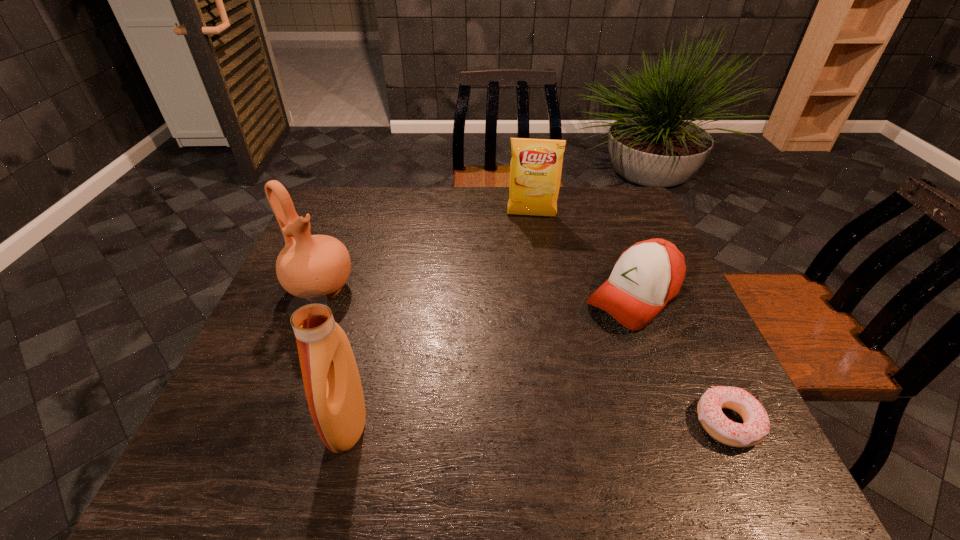
I want to click on free spot between the detergent and the doughnut, so click(x=538, y=423).

The width and height of the screenshot is (960, 540). I want to click on vacant space in between the baseball cap and the detergent, so click(x=491, y=360).

Where is `vacant region between the doughnut and the detergent`? The image size is (960, 540). vacant region between the doughnut and the detergent is located at coordinates (538, 423).

This screenshot has height=540, width=960. I want to click on free space between the pottery and the third object from left to right, so click(426, 252).

Where is `vacant space that is in between the pottery and the doughnut`? The width and height of the screenshot is (960, 540). vacant space that is in between the pottery and the doughnut is located at coordinates (524, 356).

The width and height of the screenshot is (960, 540). I want to click on blank region between the baseball cap and the pottery, so click(x=477, y=293).

Identify the location of empty space between the shortest object and the detergent. (538, 423).

Where is `vacant space that is in between the doughnut and the baseball cap`? vacant space that is in between the doughnut and the baseball cap is located at coordinates (681, 360).

Identify which object is the third closest to the doughnut. Please provide its 2D coordinates. Your answer should be formatted as a tuple, i.e. [(x, y)], where the tuple contains the x and y coordinates of a point satisfying the conditions above.

[(536, 165)]

Identify which object is the closest to the baseball cap. Please provide its 2D coordinates. Your answer should be formatted as a tuple, i.e. [(x, y)], where the tuple contains the x and y coordinates of a point satisfying the conditions above.

[(756, 425)]